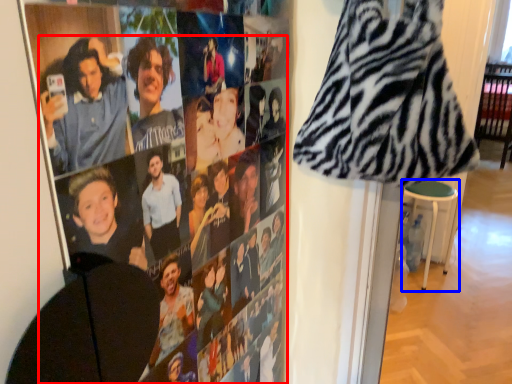
Question: Which object appears closest to the camera in this image, person (highlighted by a red box) or bar stool (highlighted by a blue box)?

Choices:
 (A) person
 (B) bar stool

Answer: (A)